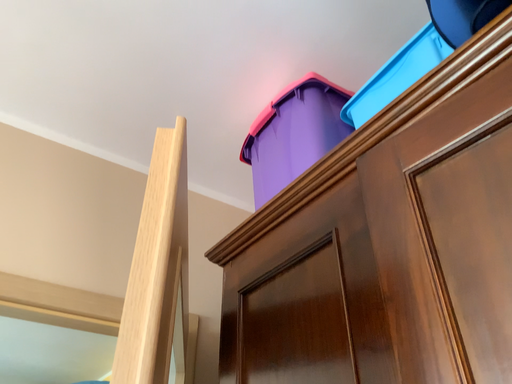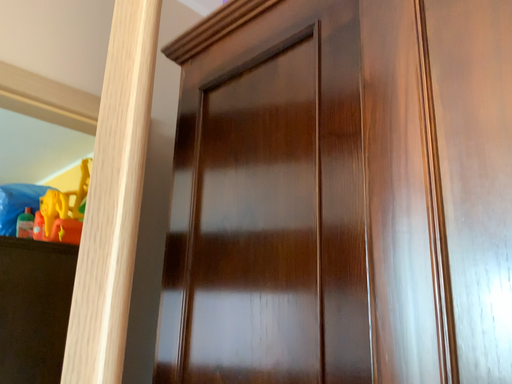
Question: Which way did the camera rotate in the video?

Choices:
 (A) rotated left
 (B) rotated right

Answer: (B)